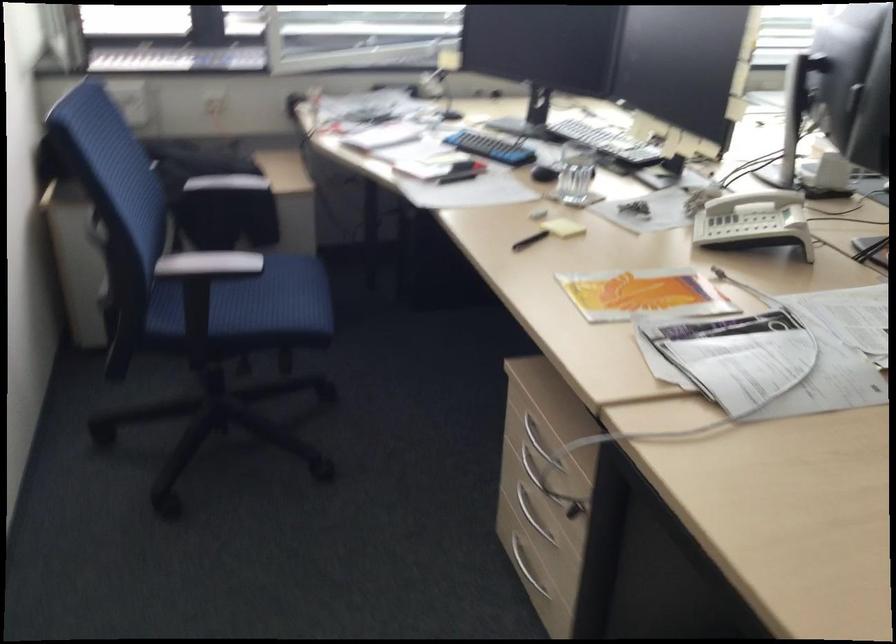
Find where to sit the blue chair sitting surface. Please return your answer as a coordinate pair (x, y).

(248, 307)